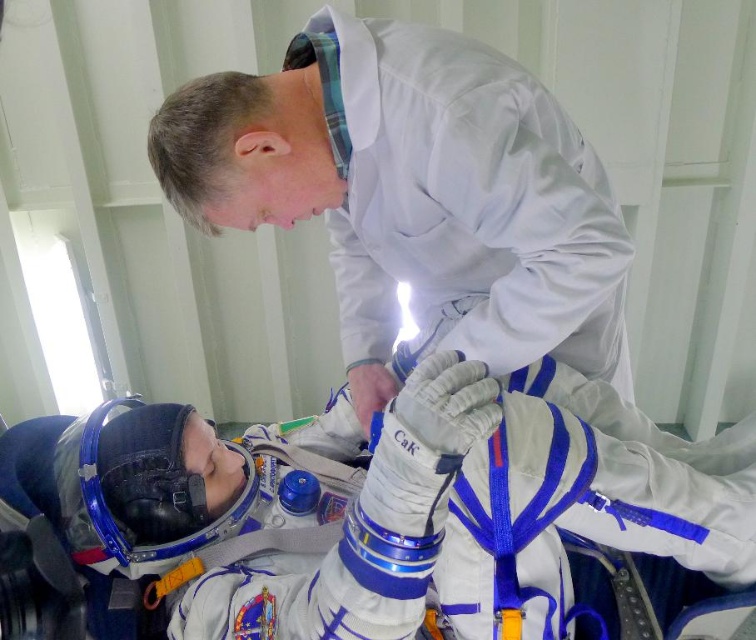
Can you confirm if white fabric spacesuit at lower left is smaller than white smooth lab coat at upper center?

Incorrect, white fabric spacesuit at lower left is not smaller in size than white smooth lab coat at upper center.

Does point (144, 406) come in front of point (516, 180)?

No, it is behind (516, 180).

Image resolution: width=756 pixels, height=640 pixels. Find the location of `white fabric spacesuit at lower left`. white fabric spacesuit at lower left is located at coordinates (407, 508).